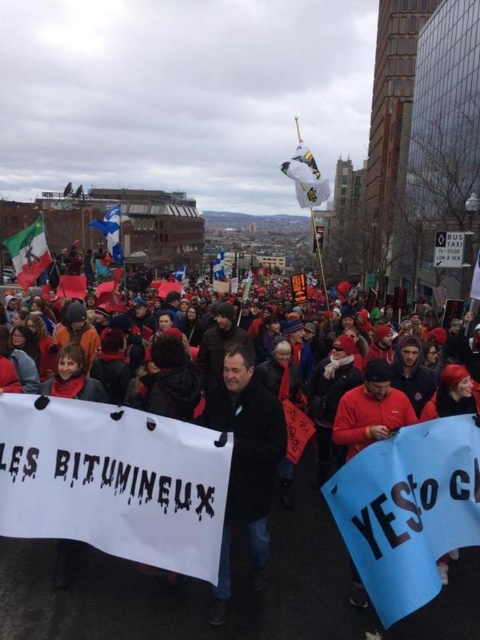
Who is more forward, (x=314, y=189) or (x=222, y=259)?

Point (x=314, y=189) is in front.

Locate an element on the screen. white fabric flag at upper center is located at coordinates (305, 177).

Image resolution: width=480 pixels, height=640 pixels. Identify the location of white fabric flag at upper center. (305, 177).

Is matte plastic flag at left below white fabric flag at center?

Yes, matte plastic flag at left is below white fabric flag at center.

Can you confirm if matte plastic flag at left is wider than white fabric flag at center?

Incorrect, matte plastic flag at left's width does not surpass white fabric flag at center's.

Which is behind, point (4, 240) or point (220, 273)?

The point (220, 273) is behind.

You are a GUI agent. You are given a task and a screenshot of the screen. Output one action in this format:
    pyautogui.click(x=<x>, y=<y>)
    Task: Click on the matte plastic flag at left
    
    Given the screenshot: What is the action you would take?
    (28, 252)

Who is lower down, blue fabric flag at upper center or white fabric flag at center?

blue fabric flag at upper center is lower down.

Locate an element on the screen. blue fabric flag at upper center is located at coordinates [x=110, y=232].

What are the coordinates of `blue fabric flag at upper center` in the screenshot? It's located at (110, 232).